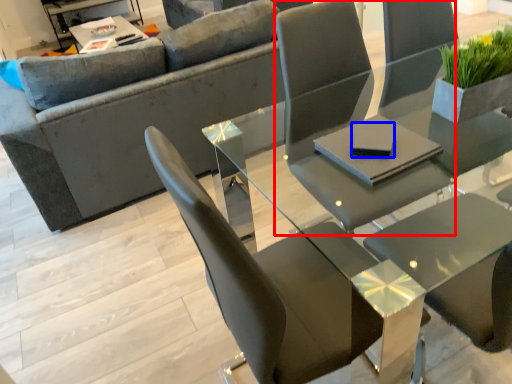
Question: Which of the following is the closest to the observer, chair (highlighted by a red box) or pad (highlighted by a blue box)?

Choices:
 (A) chair
 (B) pad

Answer: (A)